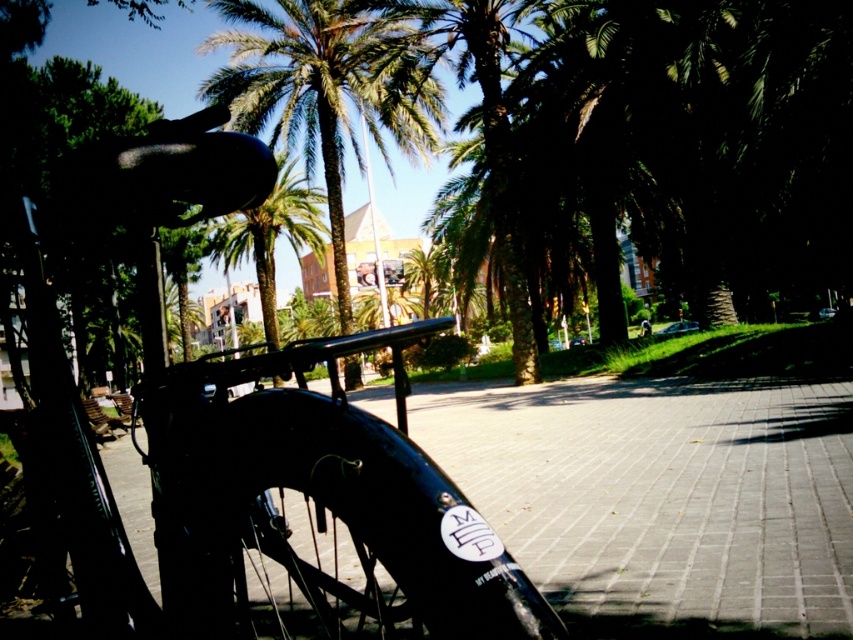
Question: Considering the real-world distances, which object is closest to the black rubber tire at center?

Choices:
 (A) green leafy palm tree at upper center
 (B) green leafy palm tree at center
 (C) green leafy tree at center

Answer: (A)

Question: Observing the image, what is the correct spatial positioning of shiny black bicycle at center in reference to black rubber tire at center?

Choices:
 (A) left
 (B) right

Answer: (B)

Question: Does black rubber tire at center appear under green leafy palm tree at upper center?

Choices:
 (A) yes
 (B) no

Answer: (A)

Question: Which point is farther from the camera taking this photo?

Choices:
 (A) (302, 186)
 (B) (717, 276)
 (C) (355, 596)
 (D) (408, 618)

Answer: (A)

Question: Is green leafy tree at center closer to the viewer compared to green leafy palm tree at center?

Choices:
 (A) yes
 (B) no

Answer: (A)

Question: Based on their relative distances, which object is farther from the green leafy palm tree at upper center?

Choices:
 (A) black rubber tire at center
 (B) green leafy tree at center

Answer: (A)